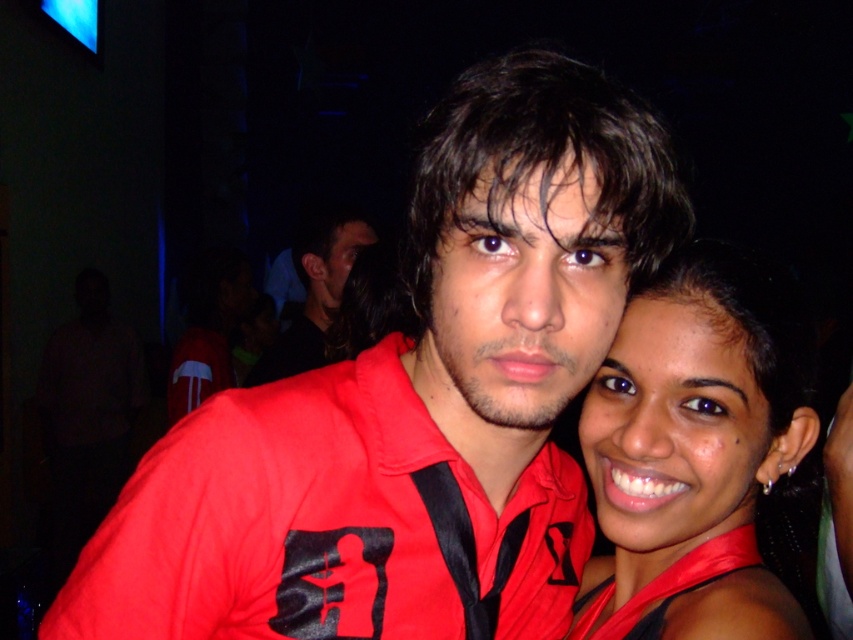
Is matte red shirt at center bigger than matte black shirt at center?

No, matte red shirt at center is not bigger than matte black shirt at center.

Is matte red shirt at center further to the viewer compared to matte black shirt at center?

No, matte red shirt at center is closer to the viewer.

Where is `matte red shirt at center`? matte red shirt at center is located at coordinates (415, 404).

Is point (512, 152) positioned behind point (675, 625)?

No, (512, 152) is closer to viewer.

Is matte red shirt at center taller than satin red dress at right?

Yes.

At what (x,y) coordinates should I click in order to perform the action: click on matte red shirt at center. Please return your answer as a coordinate pair (x, y). Looking at the image, I should click on (415, 404).

In order to click on matte red shirt at center in this screenshot , I will do `click(415, 404)`.

Based on the photo, is satin red dress at right below matte black shirt at center?

Yes.

Who is more distant from viewer, (614, 486) or (314, 353)?

The point (314, 353) is more distant.

At what (x,y) coordinates should I click in order to perform the action: click on satin red dress at right. Please return your answer as a coordinate pair (x, y). This screenshot has width=853, height=640. Looking at the image, I should click on (695, 449).